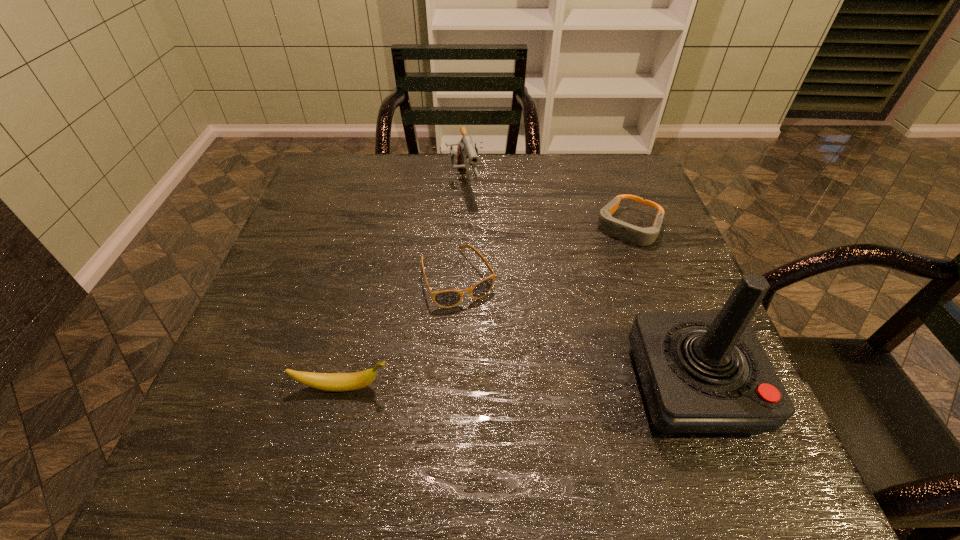
This screenshot has width=960, height=540. I want to click on vacant area situated on the front and back of the goggles, so click(549, 351).

Find the location of `vacant area situated on the front and back of the goggles`. vacant area situated on the front and back of the goggles is located at coordinates (564, 330).

The width and height of the screenshot is (960, 540). What are the coordinates of `vacant space positioned on the front and back of the goggles` in the screenshot? It's located at (578, 308).

Find the location of a particular element. The image size is (960, 540). free space located 0.170m at the barrel end of the second tallest object is located at coordinates (476, 252).

Identify the location of blank area located 0.140m at the barrel end of the second tallest object. (474, 244).

Image resolution: width=960 pixels, height=540 pixels. Find the location of `free region located at the barrel end of the second tallest object`. free region located at the barrel end of the second tallest object is located at coordinates tap(478, 257).

The width and height of the screenshot is (960, 540). I want to click on object that is at the far edge, so click(x=465, y=149).

Identify the location of banana present at the near edge. (337, 382).

This screenshot has height=540, width=960. In order to click on joystick located in the near edge section of the desktop in this screenshot , I will do `click(701, 373)`.

Where is `object present at the left edge`? This screenshot has width=960, height=540. object present at the left edge is located at coordinates (337, 382).